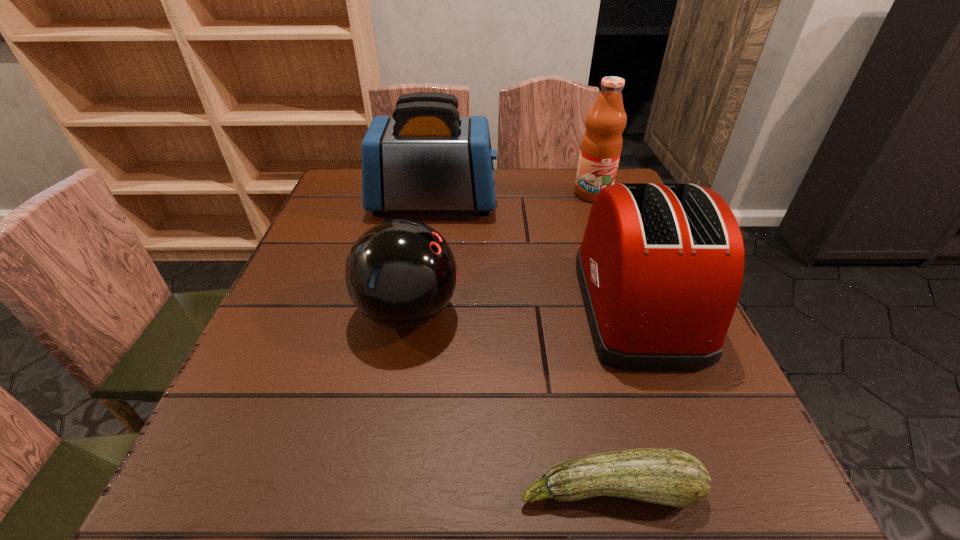
Where is `fruit juice`? The height and width of the screenshot is (540, 960). fruit juice is located at coordinates (601, 145).

Where is `the left toaster`? the left toaster is located at coordinates (426, 157).

At what (x,y) coordinates should I click in order to perform the action: click on the nearer toaster. Please return your answer as a coordinate pair (x, y). The image size is (960, 540). Looking at the image, I should click on (660, 267).

Where is `bowling ball`? bowling ball is located at coordinates (401, 274).

Where is `the nearest object`? The width and height of the screenshot is (960, 540). the nearest object is located at coordinates (665, 476).

I want to click on zucchini, so click(665, 476).

Where is `vacant space located on the front label of the fruit juice`? The image size is (960, 540). vacant space located on the front label of the fruit juice is located at coordinates (625, 280).

Locate an element on the screen. free space located 0.330m on the front-facing side of the left toaster is located at coordinates (627, 202).

Find the location of a particular element. This screenshot has height=540, width=960. vacant space located on the back of the nearer toaster is located at coordinates (x=610, y=234).

Where is `vacant space located 0.260m on the surface of the fourth tallest object near the finger holes`? vacant space located 0.260m on the surface of the fourth tallest object near the finger holes is located at coordinates tap(599, 313).